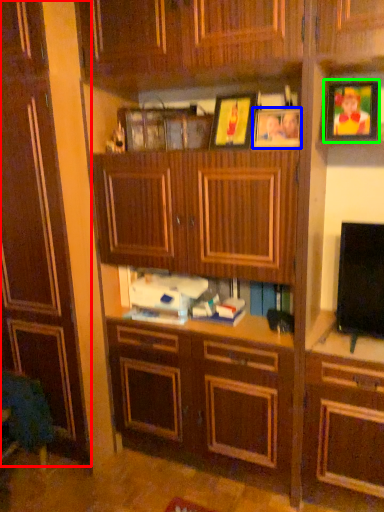
Question: Based on their relative distances, which object is nearer to cabinetry (highlighted by a red box)? Choose from picture frame (highlighted by a blue box) and picture frame (highlighted by a green box).

Choices:
 (A) picture frame
 (B) picture frame

Answer: (A)